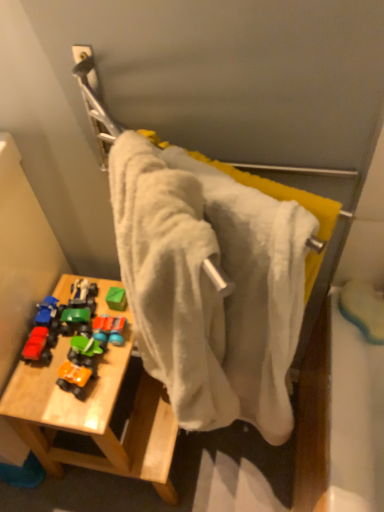
You are a GUI agent. You are given a task and a screenshot of the screen. Output one action in this format:
    pyautogui.click(x=<x>, y=<y>)
    Task: Click on the space that is in front of orange matte toy car at lower left, which appears as the 2th toy when viewed from the right
    The width and height of the screenshot is (384, 512).
    Given the screenshot: What is the action you would take?
    pyautogui.click(x=78, y=412)